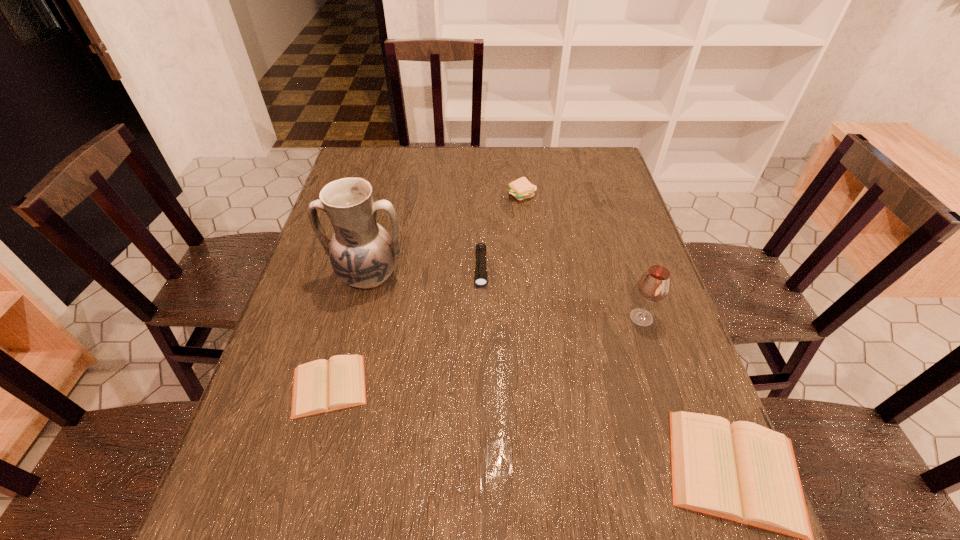
Where is `free space located 0.330m on the left of the third tallest object`? free space located 0.330m on the left of the third tallest object is located at coordinates (405, 195).

The image size is (960, 540). Find the location of `vacant space located 0.170m at the lens end of the fourth object from right to left`. vacant space located 0.170m at the lens end of the fourth object from right to left is located at coordinates (481, 342).

The height and width of the screenshot is (540, 960). I want to click on vacant space located 0.170m on the front-facing side of the tallest object, so click(x=348, y=357).

Locate an element on the screen. The image size is (960, 540). diary at the left edge is located at coordinates (320, 386).

Image resolution: width=960 pixels, height=540 pixels. In order to click on pitcher that is at the left edge in this screenshot , I will do `click(362, 253)`.

The width and height of the screenshot is (960, 540). In order to click on object present at the right edge in this screenshot , I will do `click(654, 285)`.

Find the location of `vacant region at the far edge of the desktop`. vacant region at the far edge of the desktop is located at coordinates (419, 184).

You are a GUI agent. You are given a task and a screenshot of the screen. Output one action in this format:
    pyautogui.click(x=<x>, y=<y>)
    Task: Click on the free space at the near edge of the desktop
    
    Given the screenshot: What is the action you would take?
    pyautogui.click(x=431, y=451)

Locate an element on the screen. vacant space at the left edge of the desktop is located at coordinates (298, 320).

The width and height of the screenshot is (960, 540). Identify the location of vacant space at the right edge of the desktop. (636, 253).